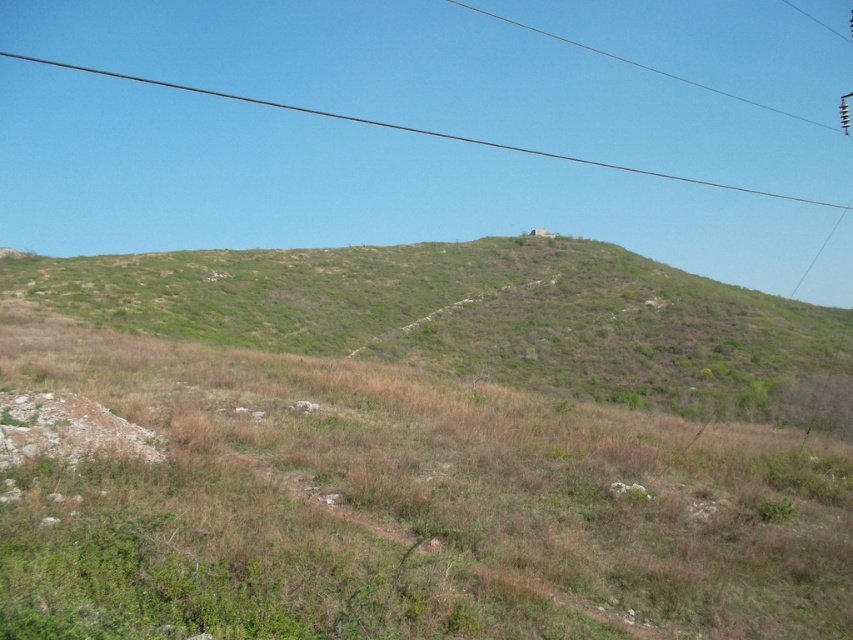
Question: Which object is positioned closest to the green grassy hillside at center?

Choices:
 (A) green grassy hillside at upper center
 (B) black wire at upper center

Answer: (A)

Question: Can you confirm if green grassy hillside at center is positioned below green grassy hillside at upper center?

Choices:
 (A) yes
 (B) no

Answer: (A)

Question: Which of the following is the farthest from the observer?

Choices:
 (A) green grassy hillside at upper center
 (B) green grassy hillside at center

Answer: (A)

Question: Which object is farther from the camera taking this photo?

Choices:
 (A) green grassy hillside at center
 (B) black wire at upper center

Answer: (B)

Question: Is green grassy hillside at center to the left of black wire at upper center from the viewer's perspective?

Choices:
 (A) yes
 (B) no

Answer: (A)

Question: Does green grassy hillside at center appear over black wire at upper center?

Choices:
 (A) no
 (B) yes

Answer: (A)